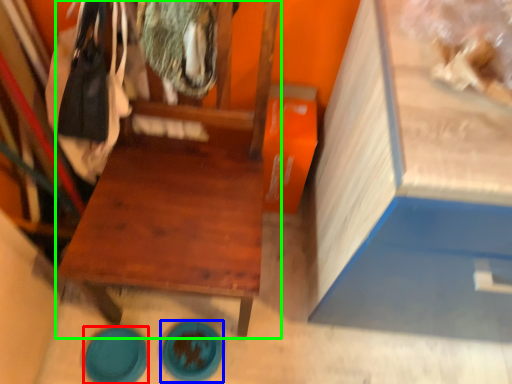
Question: Which object is positioned closest to plate (highlighted by a red box)? Select from plate (highlighted by a blue box) and furniture (highlighted by a green box).

Choices:
 (A) plate
 (B) furniture

Answer: (A)